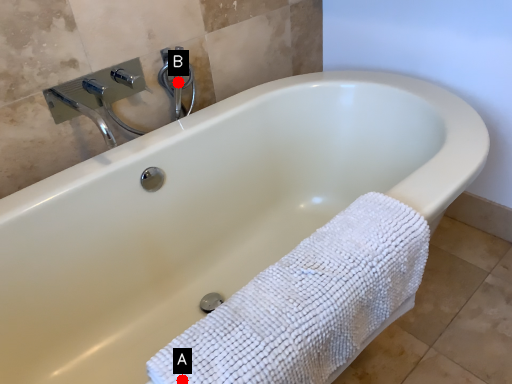
Question: Two points are circled on the image, labeled by A and B beside each circle. Which point is further to the camera?

Choices:
 (A) A is further
 (B) B is further

Answer: (B)